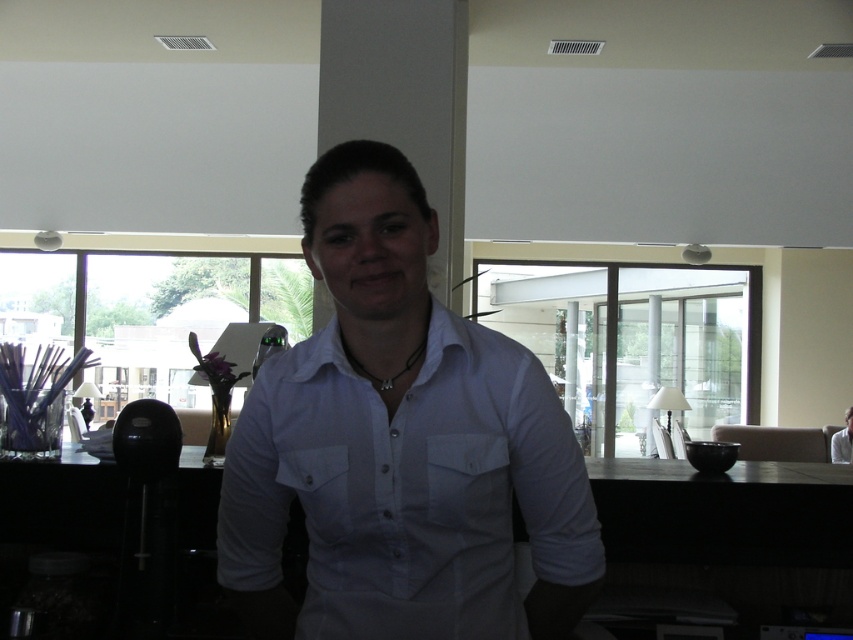
You are trying to decide which shirt to wear for a meeting. You have a white cotton shirt at center and a white shirt at center in your closet. According to the image, which shirt is wider?

The white cotton shirt at center is wider than the white shirt at center.

You are a delivery person who needs to hand over a package to the person wearing the white cotton shirt at center. You are currently standing 1.12 meters away from them. According to the image, can you safely hand them the package without needing to move closer?

The white cotton shirt at center and viewer are 1.12 meters apart. Since the distance is already 1.12 meters, you can safely hand over the package without needing to move closer as the distance is appropriate for handing over items.